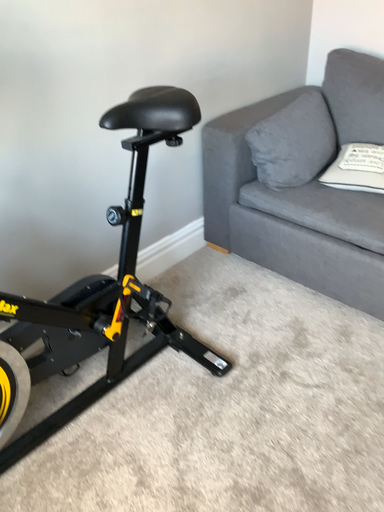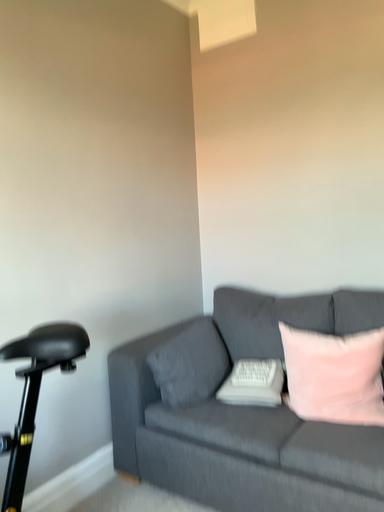
Question: Which way did the camera rotate in the video?

Choices:
 (A) rotated right
 (B) rotated left

Answer: (A)